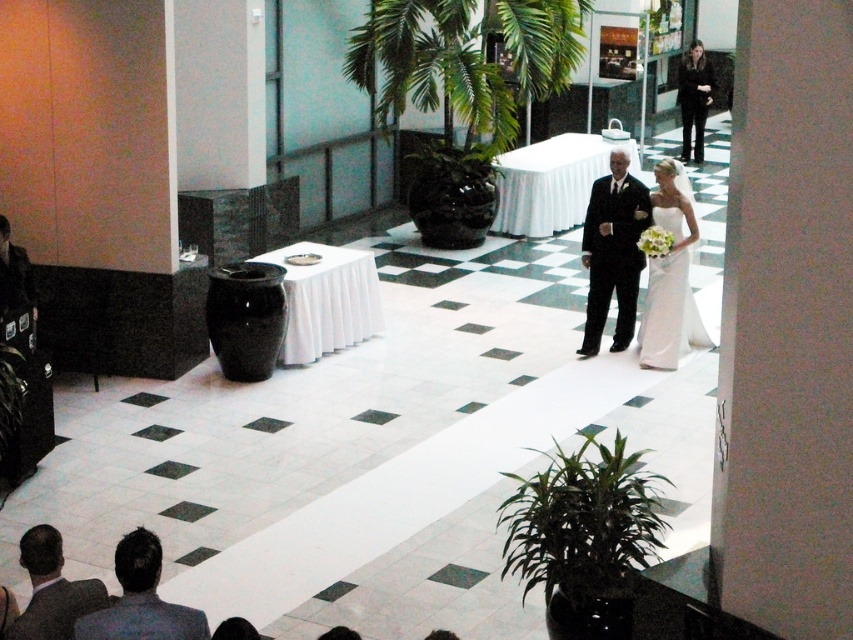
You are a photographer positioned at the entrance of the aisle. You need to capture a photo that includes both the white satin dress at center and the gray suit at lower left. Which direction should you move to ensure both are in frame?

You should move to the left so that both the white satin dress at center and the gray suit at lower left can be captured in the photo. Since the white satin dress at center is to the right of the gray suit at lower left, moving left will allow you to include both in your frame.